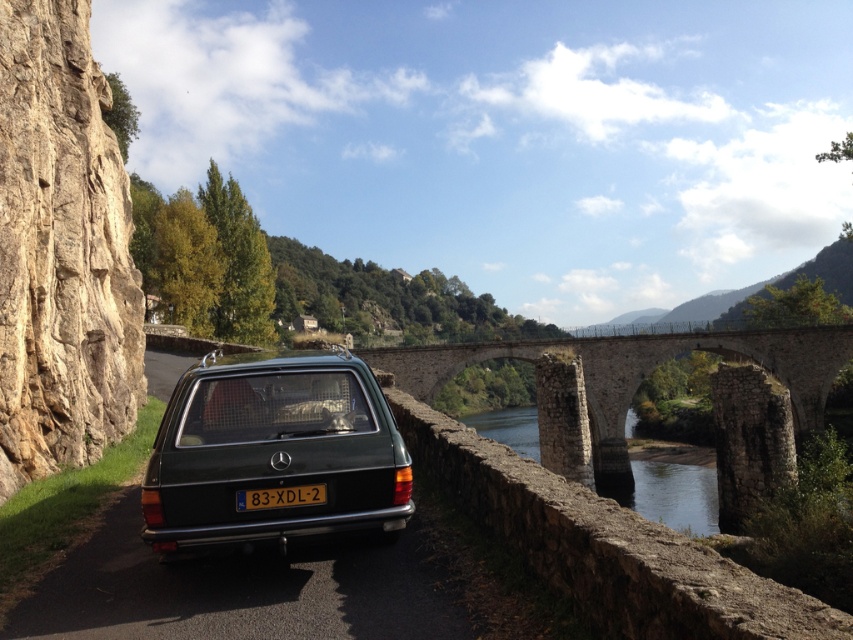
You are a photographer planning to take a photo of the metallic green station wagon at center and the black plastic license plate at center. Since you want to ensure both are clearly visible, which object should you focus on first to avoid blurriness?

The metallic green station wagon at center is bigger than the black plastic license plate at center, so you should focus on the metallic green station wagon at center first to ensure clarity before adjusting for the smaller license plate.

You are a tourist standing on the stone arch bridge at center and want to take a photo of the clear stone water at center. Which direction should you face to capture the water in your shot?

To capture the clear stone water at center, you should face to the right since the stone arch bridge at center is located to the left of the clear stone water at center.

You are a photographer planning to take a picture of the metallic green station wagon at center and the clear stone water at center. Based on their positions, which object is closer to the left edge of the photo?

The metallic green station wagon at center is positioned on the left side of clear stone water at center, so it is closer to the left edge of the photo.